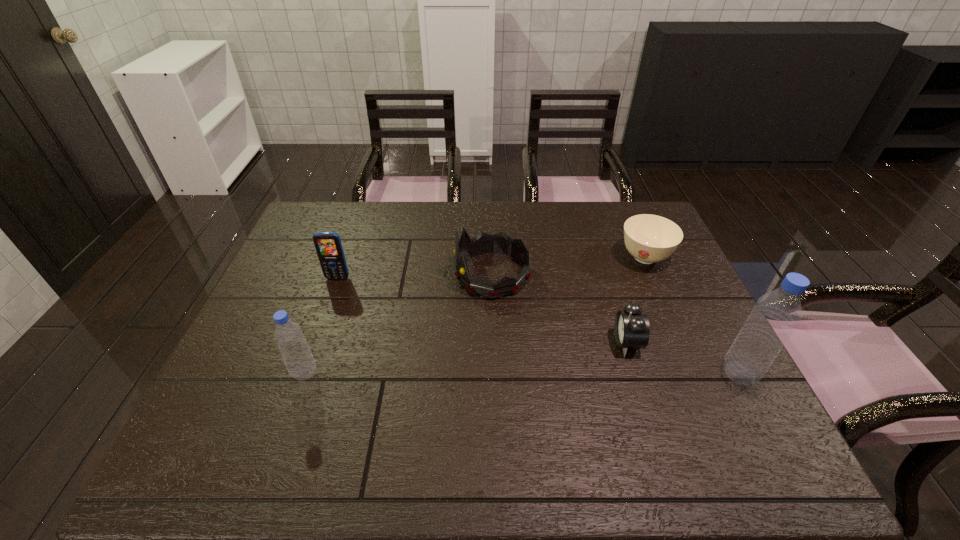
Please determine a free point for an extra bottle to ensure balance. Please provide its 2D coordinates. Your answer should be formatted as a tuple, i.e. [(x, y)], where the tuple contains the x and y coordinates of a point satisfying the conditions above.

[(522, 373)]